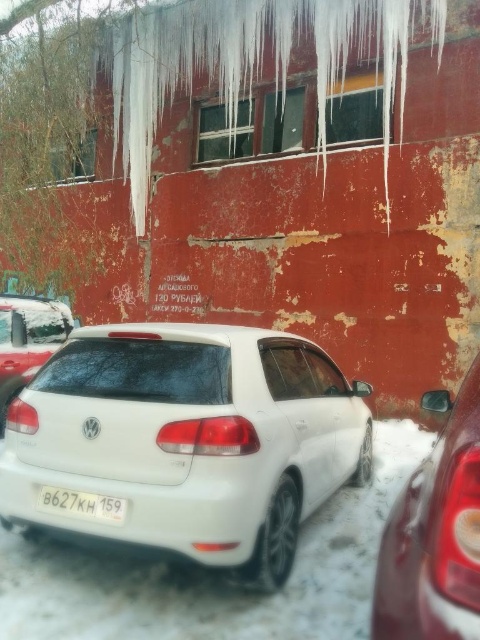
Question: Which of the following is the farthest from the observer?

Choices:
 (A) shiny red tail light at right
 (B) white plastic license plate at center
 (C) white matte car at upper left

Answer: (C)

Question: Does shiny red tail light at right have a larger size compared to white matte car at upper left?

Choices:
 (A) yes
 (B) no

Answer: (B)

Question: Which of these objects is positioned closest to the shiny red tail light at right?

Choices:
 (A) white plastic license plate at center
 (B) white glossy hatchback at center

Answer: (A)

Question: Is white glossy hatchback at center smaller than shiny red tail light at right?

Choices:
 (A) no
 (B) yes

Answer: (A)

Question: Which object is closer to the camera taking this photo?

Choices:
 (A) white glossy hatchback at center
 (B) white plastic license plate at center

Answer: (A)

Question: Does white matte car at upper left appear over white plastic license plate at center?

Choices:
 (A) yes
 (B) no

Answer: (A)